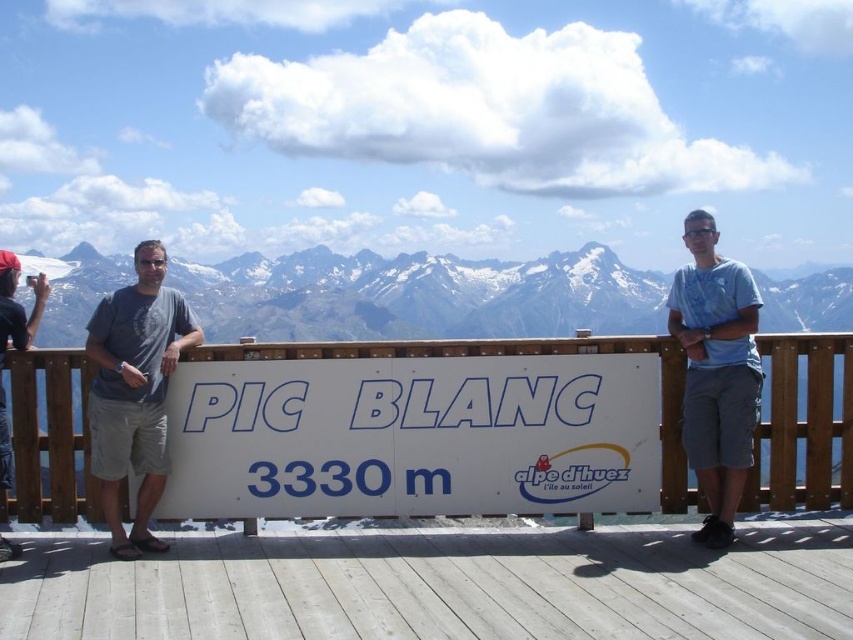
Is point (358, 301) positioned behind point (16, 337)?

That is True.

Is white snow-covered mountains at upper center to the right of dark blue t-shirt at left from the viewer's perspective?

In fact, white snow-covered mountains at upper center is to the left of dark blue t-shirt at left.

Is point (775, 321) more distant than point (12, 298)?

That is True.

Locate an element on the screen. The width and height of the screenshot is (853, 640). white snow-covered mountains at upper center is located at coordinates (421, 296).

Can you confirm if white wooden deck at center is shorter than white plastic sign at center?

Correct, white wooden deck at center is not as tall as white plastic sign at center.

Does white wooden deck at center have a larger size compared to white plastic sign at center?

Yes, white wooden deck at center is bigger than white plastic sign at center.

Which is in front, point (625, 595) or point (265, 483)?

Point (625, 595) is more forward.

At what (x,y) coordinates should I click in order to perform the action: click on white wooden deck at center. Please return your answer as a coordinate pair (x, y). Looking at the image, I should click on (440, 586).

Which is behind, point (521, 531) or point (48, 289)?

Positioned behind is point (48, 289).

Does point (332, 566) come behind point (30, 284)?

No, it is not.

The height and width of the screenshot is (640, 853). In order to click on white wooden deck at center in this screenshot , I will do `click(440, 586)`.